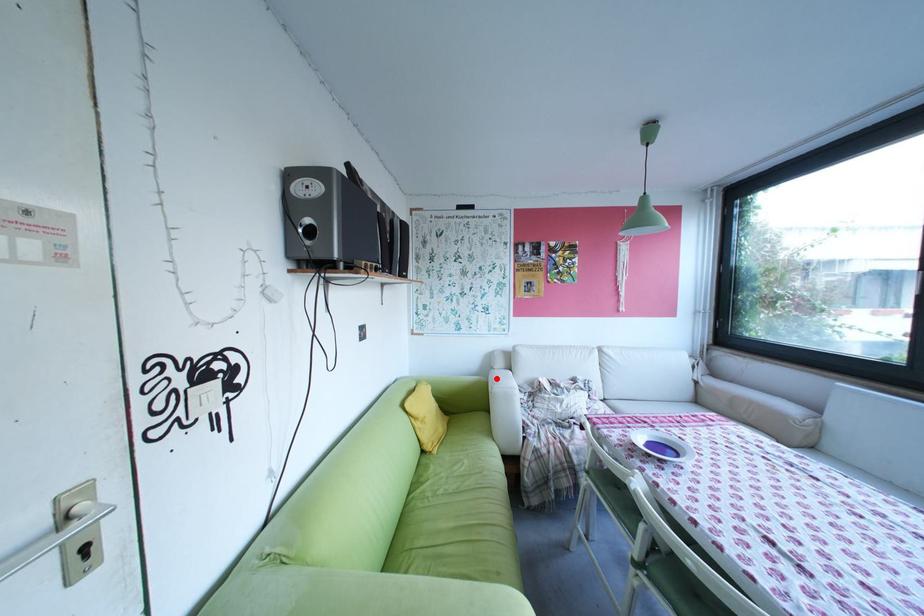
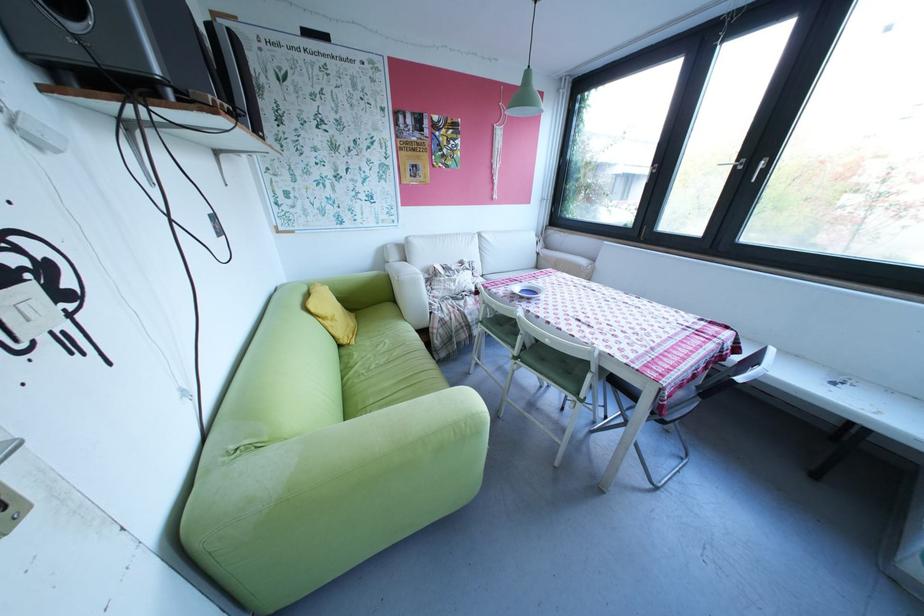
Question: I am providing you with two images of the same scene from different viewpoints. In image1, a red point is highlighted. Considering the same 3D point in image2, which of the following is correct?

Choices:
 (A) It is closer
 (B) It is farther

Answer: (A)